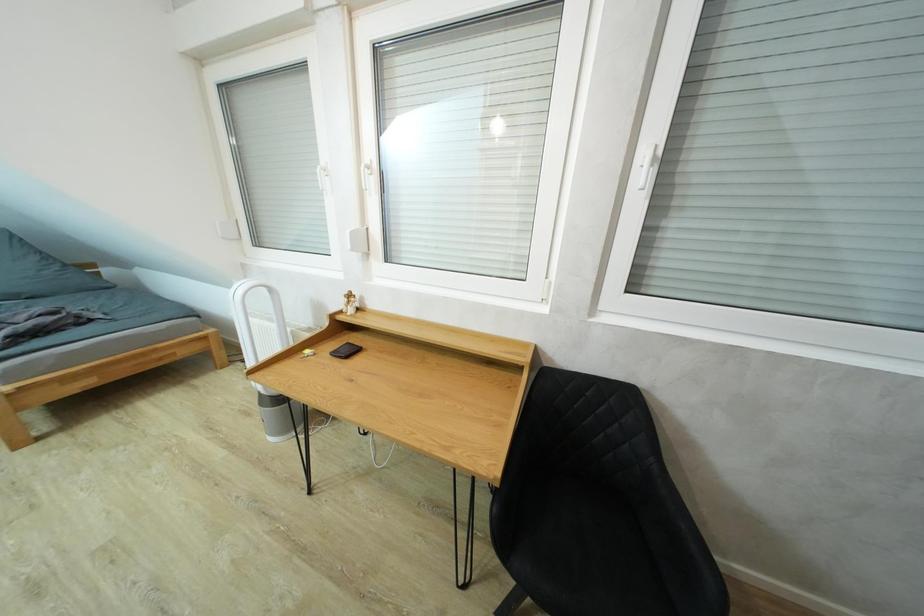
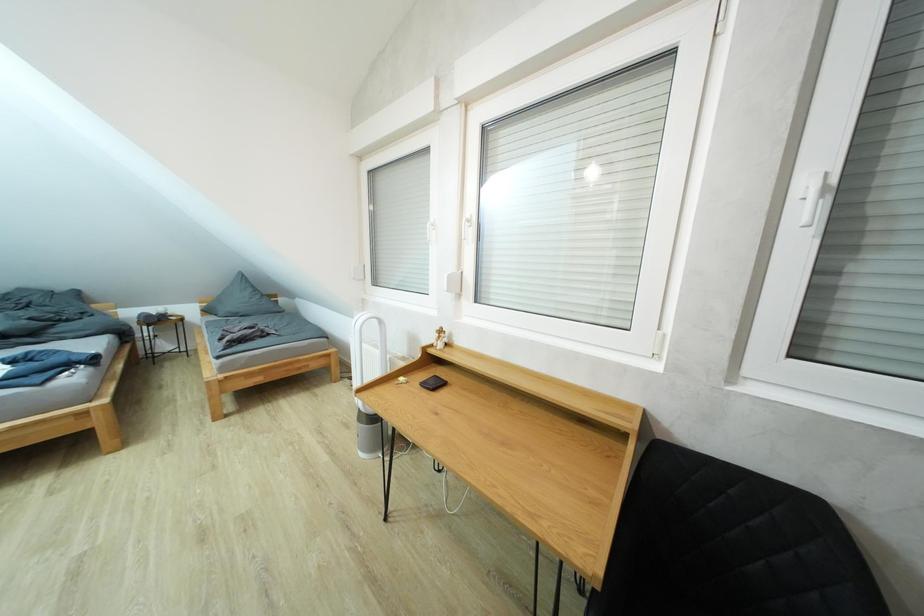
Question: Based on the continuous images, in which direction is the camera rotating? Reply with the corresponding letter.

Choices:
 (A) Left
 (B) Right
 (C) Up
 (D) Down

Answer: (A)